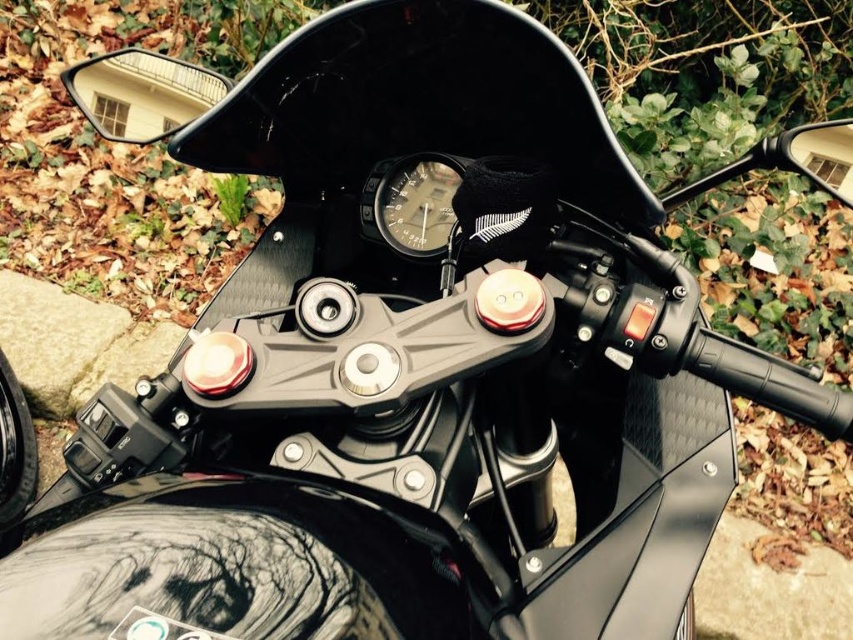
Is matte black mirror at upper left taller than glossy black mirror at upper right?

No.

Is point (161, 56) closer to camera compared to point (827, 134)?

No.

Image resolution: width=853 pixels, height=640 pixels. I want to click on matte black mirror at upper left, so click(141, 93).

The image size is (853, 640). Identify the location of matte black mirror at upper left. (141, 93).

Between matte black mirror at upper left and matte black speedometer at center, which one is positioned lower?

Positioned lower is matte black speedometer at center.

Is matte black mirror at upper left shorter than matte black speedometer at center?

Incorrect, matte black mirror at upper left's height does not fall short of matte black speedometer at center's.

This screenshot has width=853, height=640. Find the location of `matte black mirror at upper left`. matte black mirror at upper left is located at coordinates (141, 93).

Is matte black speedometer at center wider than glossy black mirror at upper right?

In fact, matte black speedometer at center might be narrower than glossy black mirror at upper right.

Between matte black speedometer at center and glossy black mirror at upper right, which one is positioned lower?

Positioned lower is matte black speedometer at center.

Find the location of a particular element. This screenshot has height=640, width=853. matte black speedometer at center is located at coordinates point(413,202).